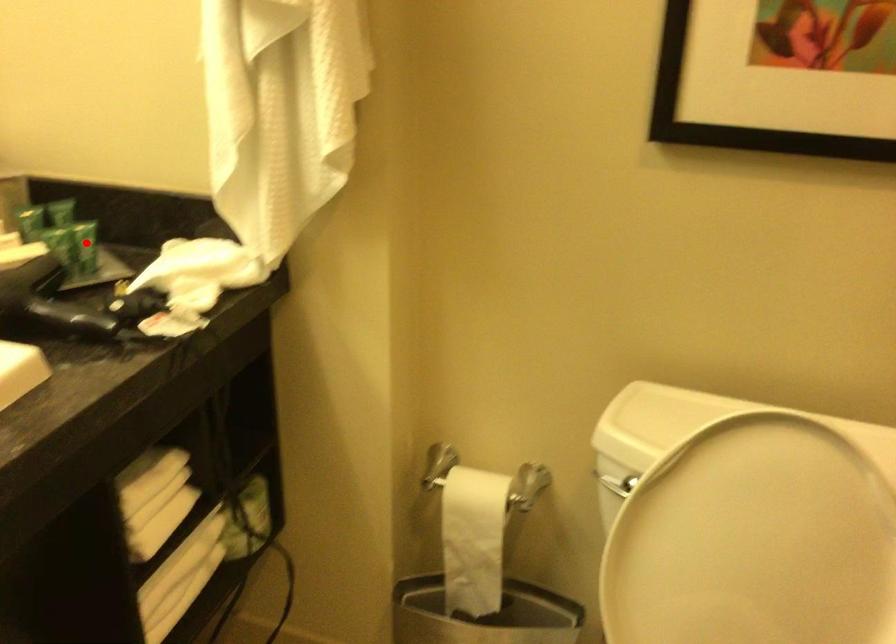
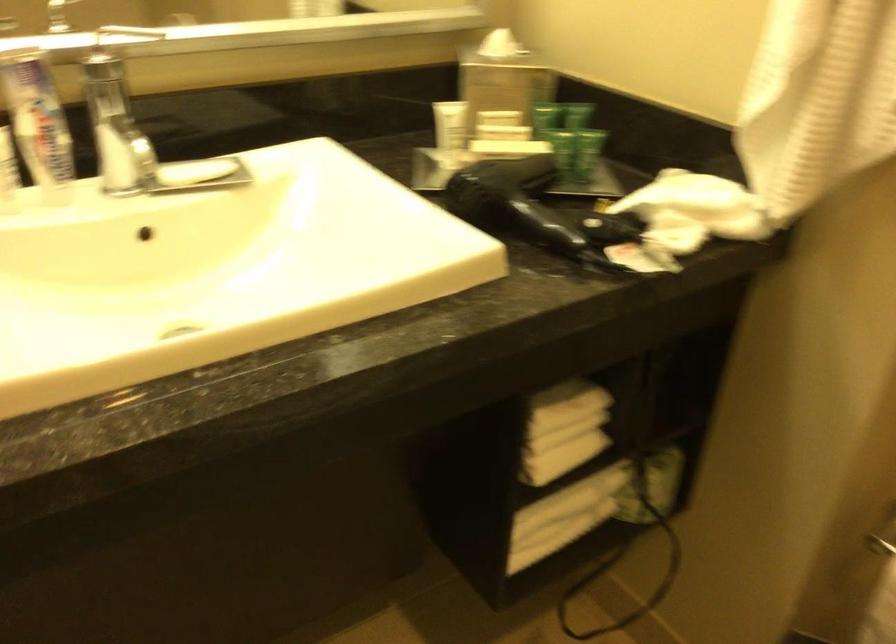
Question: I am providing you with two images of the same scene from different viewpoints. A red point is marked on the first image. At the location where the point appears in image 1, is it still visible in image 2?

Choices:
 (A) Yes
 (B) No

Answer: (A)